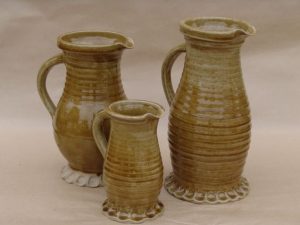
The height and width of the screenshot is (225, 300). Identify the location of medium pitcher body. (78, 107).